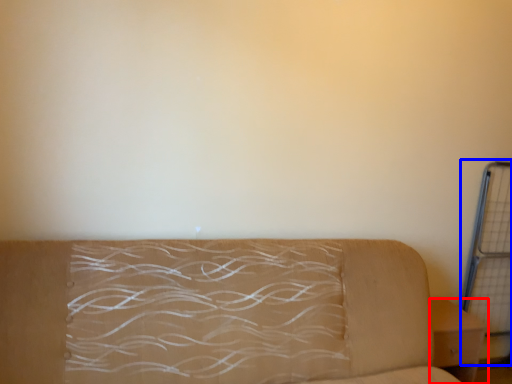
Question: Among these objects, which one is farthest to the camera, furniture (highlighted by a red box) or cage (highlighted by a blue box)?

Choices:
 (A) furniture
 (B) cage

Answer: (B)